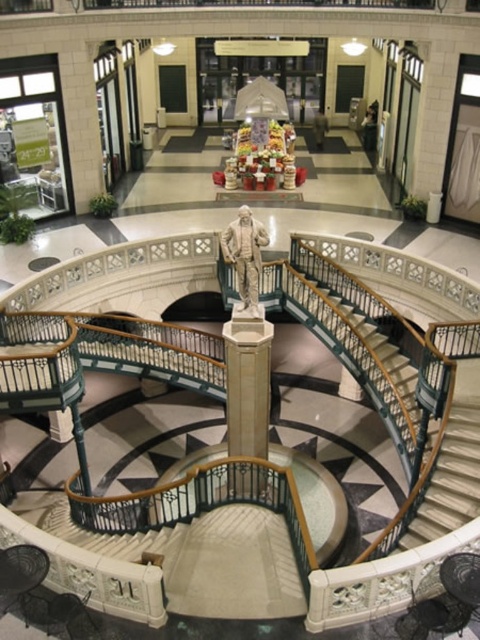
You are standing in the elegant interior space with the spiral staircase. There are two points marked on the floor, one at coordinates point (x=266, y=456) and the other at point (x=251, y=214). Which point is closer to you as you face the staircase?

Point (x=251, y=214) is closer to you because it is less further to the camera than point (x=266, y=456).

You are standing in the grand space and want to reach the point marked at coordinates (265, 390). The spiral staircase is in your way. Can you walk around the staircase to reach that point?

The point marked at coordinates (265, 390) is 34.74 feet away from the viewer, so yes, you can walk around the spiral staircase to reach it since the distance is sufficient to navigate around the staircase.